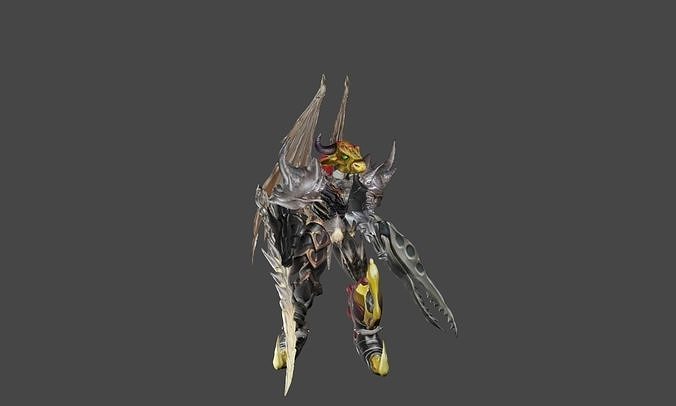
This screenshot has height=406, width=676. What are the coordinates of `chest` in the screenshot? It's located at (335, 186).